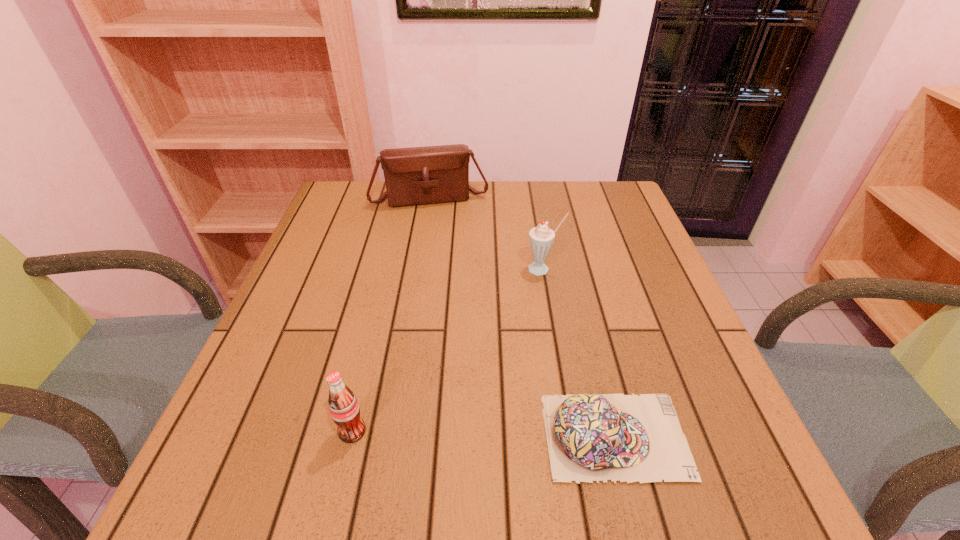
Where is `blank space located 0.370m on the front flap of the farthest object`? blank space located 0.370m on the front flap of the farthest object is located at coordinates pos(459,296).

You are a GUI agent. You are given a task and a screenshot of the screen. Output one action in this format:
    pyautogui.click(x=<x>, y=<y>)
    Task: Click on the free location located on the front flap of the farthest object
    
    Given the screenshot: What is the action you would take?
    pyautogui.click(x=445, y=235)

At what (x,y) coordinates should I click in order to perform the action: click on object located at the far edge. Please return your answer as a coordinate pair (x, y). This screenshot has height=540, width=960. Looking at the image, I should click on [432, 174].

The image size is (960, 540). In order to click on soda present at the near edge in this screenshot , I will do `click(344, 409)`.

The height and width of the screenshot is (540, 960). I want to click on cap located at the near edge, so click(591, 437).

I want to click on object at the left edge, so (432, 174).

Locate an element on the screen. Image resolution: width=960 pixels, height=540 pixels. object positioned at the right edge is located at coordinates (591, 437).

I want to click on object that is at the far left corner, so (432, 174).

What are the coordinates of `object present at the near right corner` in the screenshot? It's located at (591, 437).

You are a GUI agent. You are given a task and a screenshot of the screen. Output one action in this format:
    pyautogui.click(x=<x>, y=<y>)
    Task: Click on the free space at the far edge
    The width and height of the screenshot is (960, 540).
    Given the screenshot: What is the action you would take?
    pyautogui.click(x=552, y=192)